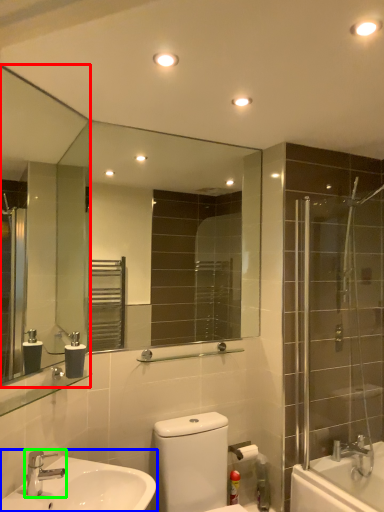
Question: Estimate the real-world distances between objects in this image. Which object is farther from mirror (highlighted by a red box), sink (highlighted by a blue box) or tap (highlighted by a green box)?

Choices:
 (A) sink
 (B) tap

Answer: (B)